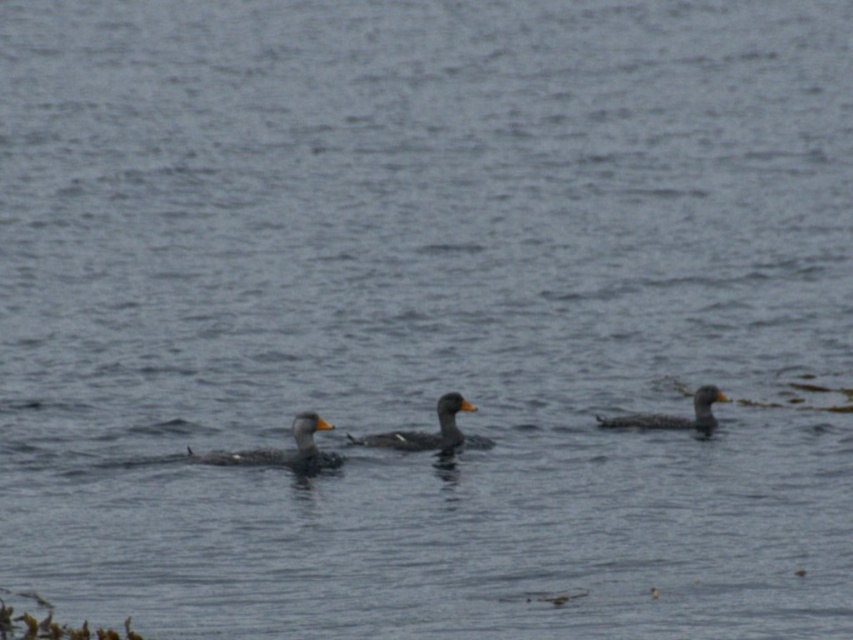
Who is shorter, gray matte duck at center or speckled gray duck at center?

speckled gray duck at center

Is point (279, 454) more distant than point (405, 436)?

No, (279, 454) is closer to viewer.

Is point (296, 436) positioned in front of point (445, 436)?

Yes, point (296, 436) is in front of point (445, 436).

The image size is (853, 640). What are the coordinates of `gray matte duck at center` in the screenshot? It's located at 280,449.

Is speckled gray duck at center below speckled gray duck at right?

Indeed, speckled gray duck at center is positioned under speckled gray duck at right.

Is point (444, 445) less distant than point (648, 428)?

Yes.

Is point (355, 444) behind point (693, 426)?

No.

The width and height of the screenshot is (853, 640). Identify the location of speckled gray duck at center. (427, 433).

Describe the element at coordinates (280, 449) in the screenshot. I see `gray matte duck at center` at that location.

Does point (306, 428) lie behind point (715, 394)?

No, (306, 428) is in front of (715, 394).

Does point (192, 458) come behind point (704, 420)?

No, it is in front of (704, 420).

The width and height of the screenshot is (853, 640). I want to click on gray matte duck at center, so click(x=280, y=449).